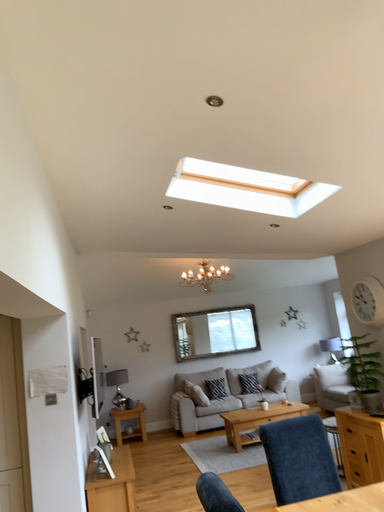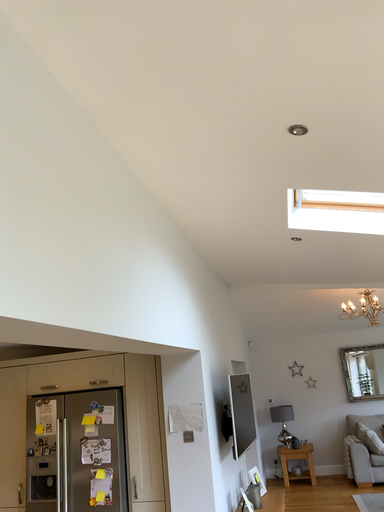
Question: How did the camera likely rotate when shooting the video?

Choices:
 (A) rotated left
 (B) rotated right

Answer: (A)